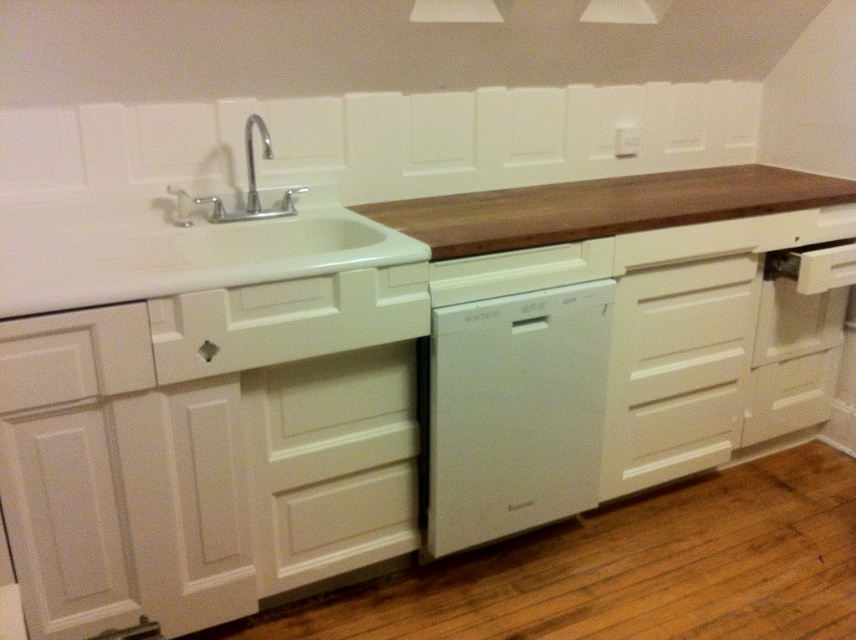
Who is higher up, white matte dishwasher at center or white wood drawer at center?

Positioned higher is white wood drawer at center.

Is white matte dishwasher at center smaller than white wood drawer at center?

Incorrect, white matte dishwasher at center is not smaller in size than white wood drawer at center.

Find the location of a particular element. white matte dishwasher at center is located at coordinates (515, 390).

Which is more to the right, white wood drawer at center or polished chrome faucet at upper left?

white wood drawer at center is more to the right.

Is white wood drawer at center thinner than polished chrome faucet at upper left?

In fact, white wood drawer at center might be wider than polished chrome faucet at upper left.

The image size is (856, 640). I want to click on white wood drawer at center, so click(284, 321).

Measure the distance between point (538, 193) and camera.

Point (538, 193) and camera are 7.67 feet apart from each other.

Can you confirm if wooden countertop at upper center is bigger than brown wood countertop at center?

Correct, wooden countertop at upper center is larger in size than brown wood countertop at center.

Locate an element on the screen. Image resolution: width=856 pixels, height=640 pixels. wooden countertop at upper center is located at coordinates (366, 232).